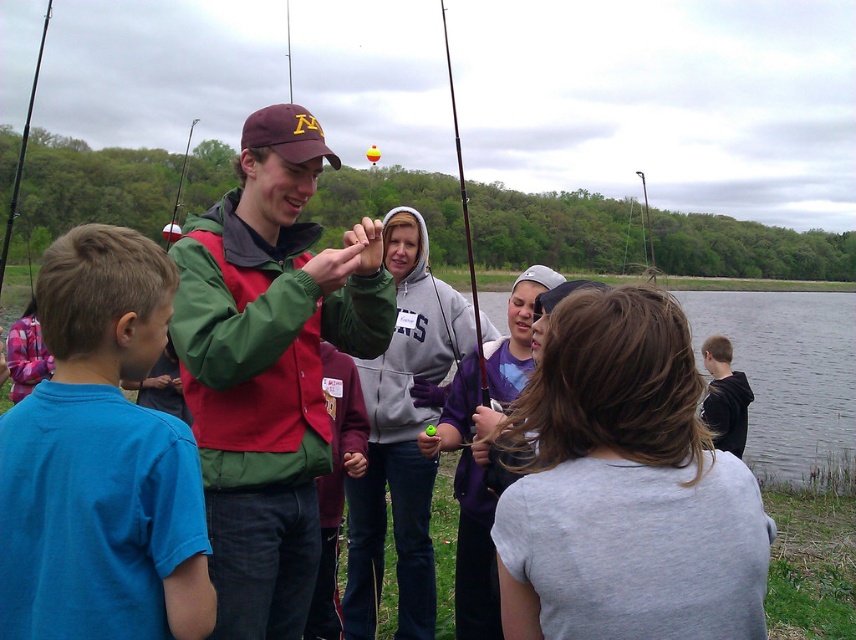
Is dark gray hoodie at lower right in front of black rod fishing pole at left?

That is False.

Who is lower down, dark gray hoodie at lower right or black rod fishing pole at left?

dark gray hoodie at lower right

Which is in front, point (721, 388) or point (9, 227)?

Point (721, 388) is in front.

The width and height of the screenshot is (856, 640). I want to click on dark gray hoodie at lower right, so click(x=724, y=396).

Is green fabric jacket at center to the left of matte red jacket at center from the viewer's perspective?

Correct, you'll find green fabric jacket at center to the left of matte red jacket at center.

Between point (271, 602) and point (360, 436), which one is positioned behind?

Point (360, 436)

Based on the photo, measure the distance between green fabric jacket at center and camera.

Result: 1.96 meters

Find the location of a particular element. This screenshot has width=856, height=640. green fabric jacket at center is located at coordinates (269, 365).

Can you confirm if green fabric jacket at center is bigger than wooden fishing pole at center?

No.

Between green fabric jacket at center and wooden fishing pole at center, which one is positioned lower?

green fabric jacket at center is lower down.

Is point (324, 454) positioned behind point (455, 145)?

No, (324, 454) is in front of (455, 145).

Locate an element on the screen. The width and height of the screenshot is (856, 640). green fabric jacket at center is located at coordinates (269, 365).